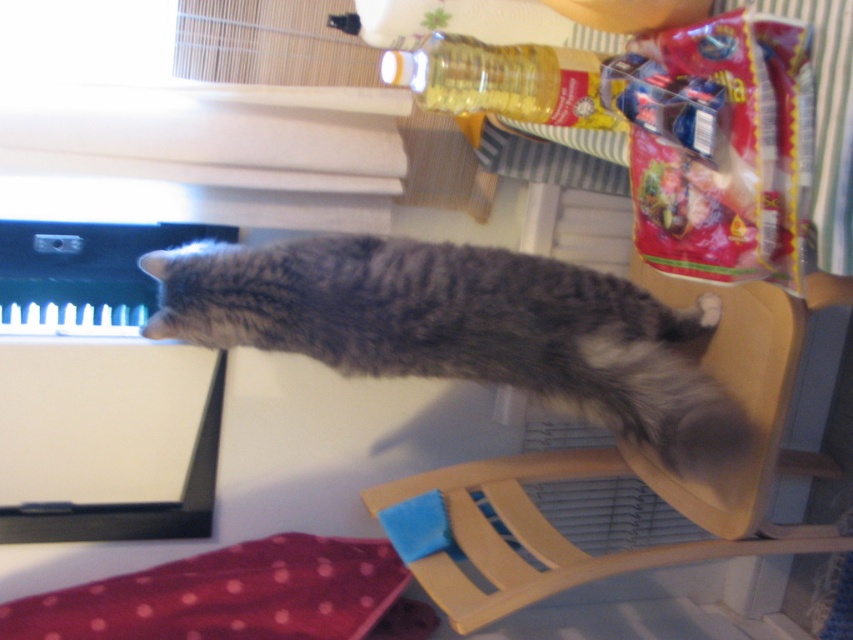
Identify the location of gray fluffy cat at center. This screenshot has height=640, width=853. [x=462, y=328].

Can you confirm if gray fluffy cat at center is positioned to the left of wooden chair at upper right?

Yes, gray fluffy cat at center is to the left of wooden chair at upper right.

Locate an element on the screen. Image resolution: width=853 pixels, height=640 pixels. gray fluffy cat at center is located at coordinates click(x=462, y=328).

Is wooden chair at upper right bigger than translucent plastic bottle at upper center?

Correct, wooden chair at upper right is larger in size than translucent plastic bottle at upper center.

Is wooden chair at upper right above translucent plastic bottle at upper center?

No, wooden chair at upper right is not above translucent plastic bottle at upper center.

Where is `wooden chair at upper right`? The height and width of the screenshot is (640, 853). wooden chair at upper right is located at coordinates (636, 470).

Is gray fluffy cat at center closer to the viewer compared to translucent plastic bottle at upper center?

No.

Is gray fluffy cat at center bigger than translucent plastic bottle at upper center?

Correct, gray fluffy cat at center is larger in size than translucent plastic bottle at upper center.

Between point (550, 388) and point (431, 38), which one is positioned in front?

Point (431, 38)

Locate an element on the screen. gray fluffy cat at center is located at coordinates (462, 328).